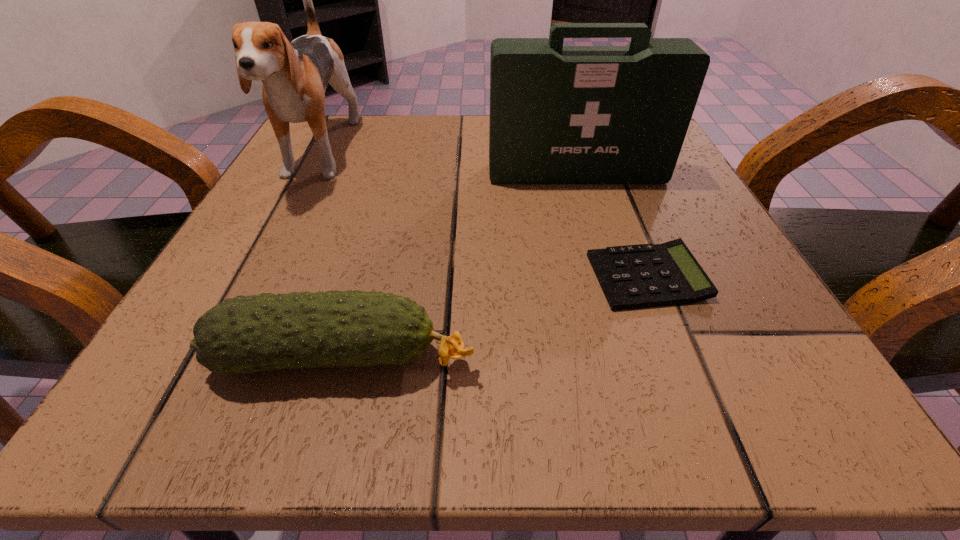
Where is `vacant area that lies between the first-aid kit and the cucumber`? vacant area that lies between the first-aid kit and the cucumber is located at coordinates (461, 265).

Image resolution: width=960 pixels, height=540 pixels. What are the coordinates of `free space between the nearest object and the shortest object` in the screenshot? It's located at (495, 317).

I want to click on free area in between the cucumber and the second nearest object, so click(495, 317).

Find the location of a particular element. unoccupied position between the shortest object and the third tallest object is located at coordinates (495, 317).

Find the location of a particular element. This screenshot has height=540, width=960. vacant space in between the puppy and the nearest object is located at coordinates (332, 256).

This screenshot has width=960, height=540. Identify the location of vacant space that's between the third shortest object and the shortest object. (612, 225).

The height and width of the screenshot is (540, 960). In order to click on object that is the nearest to the nearest object in this screenshot , I will do `click(638, 276)`.

The width and height of the screenshot is (960, 540). I want to click on the second closest object to the calculator, so click(559, 114).

Locate an element on the screen. Image resolution: width=960 pixels, height=540 pixels. vacant region that satisfies the following two spatial constraints: 1. on the front-facing side of the calculator; 2. on the right side of the second tallest object is located at coordinates (607, 277).

Find the location of a particular element. This screenshot has height=540, width=960. vacant area in the image that satisfies the following two spatial constraints: 1. at the face of the shortest object; 2. on the left side of the tallest object is located at coordinates (255, 277).